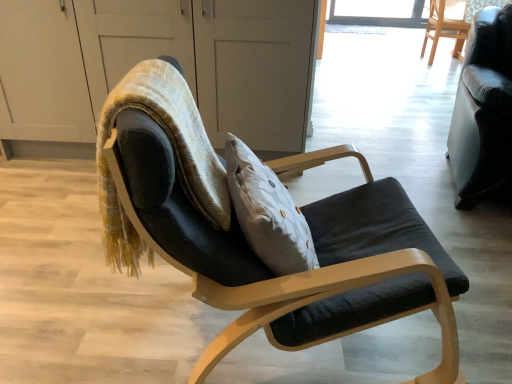
Question: Looking at the image, does wooden chair at upper right, the 3th chair from the bottom, seem bigger or smaller compared to black leather couch at right, placed as the 2th chair when sorted from left to right?

Choices:
 (A) small
 (B) big

Answer: (A)

Question: Is wooden chair at upper right, the 3th chair when ordered from left to right, in front of or behind black leather couch at right, which is counted as the 2th chair, starting from the back, in the image?

Choices:
 (A) behind
 (B) front

Answer: (A)

Question: Which object is the closest to the velvet textured bean bag chair at center?

Choices:
 (A) transparent glass screen door at upper center
 (B) matte black chair at center, acting as the third chair starting from the top
 (C) black leather couch at right, placed as the 2th chair when sorted from left to right
 (D) wooden chair at upper right, arranged as the first chair when viewed from the back

Answer: (B)

Question: Which object is positioned farthest from the velvet textured bean bag chair at center?

Choices:
 (A) black leather couch at right, which is counted as the 2th chair, starting from the back
 (B) wooden chair at upper right, arranged as the first chair when viewed from the back
 (C) matte black chair at center, which appears as the 1th chair when viewed from the left
 (D) transparent glass screen door at upper center

Answer: (B)